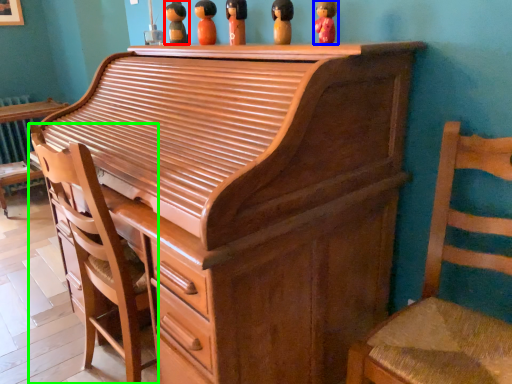
Question: Which object is positioned farthest from toy (highlighted by a red box)? Select from toy (highlighted by a blue box) and chair (highlighted by a green box).

Choices:
 (A) toy
 (B) chair

Answer: (B)